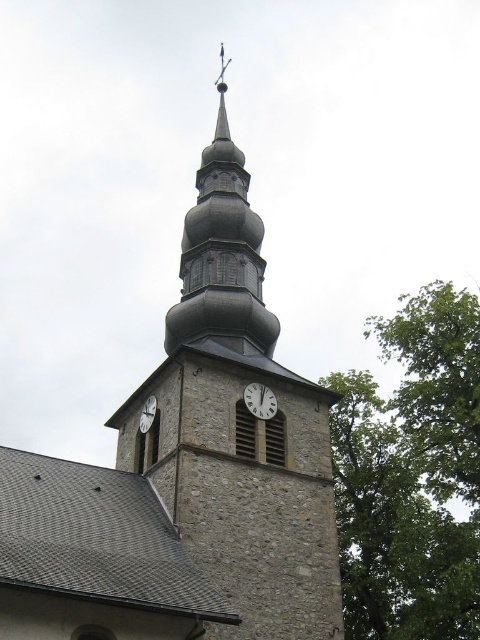
How far apart are stone clock tower at center and white matte clock at center?

They are 5.31 meters apart.

Who is more distant from viewer, (302, 529) or (267, 394)?

Point (267, 394)

Is point (200, 547) closer to camera compared to point (260, 401)?

Yes, point (200, 547) is in front of point (260, 401).

The height and width of the screenshot is (640, 480). Identify the location of stone clock tower at center. (238, 426).

Looking at this image, does green leafy tree at upper right appear over white glossy clock at center?

No.

Does point (370, 410) come farther from viewer compared to point (146, 416)?

Yes, it is behind point (146, 416).

Describe the element at coordinates (411, 474) in the screenshot. The width and height of the screenshot is (480, 640). I see `green leafy tree at upper right` at that location.

Identify the location of green leafy tree at upper right. Image resolution: width=480 pixels, height=640 pixels. [x=411, y=474].

Which is in front, point (282, 614) or point (352, 593)?

Point (282, 614) is in front.

Is stone clock tower at center in front of green leafy tree at upper right?

That is True.

Find the location of a particular element. This screenshot has width=480, height=640. stone clock tower at center is located at coordinates pyautogui.click(x=238, y=426).

You are a GUI agent. You are given a task and a screenshot of the screen. Output one action in this format:
    pyautogui.click(x=<x>, y=<y>)
    Task: Click on the stone clock tower at center
    The width and height of the screenshot is (480, 640).
    Given the screenshot: What is the action you would take?
    pyautogui.click(x=238, y=426)